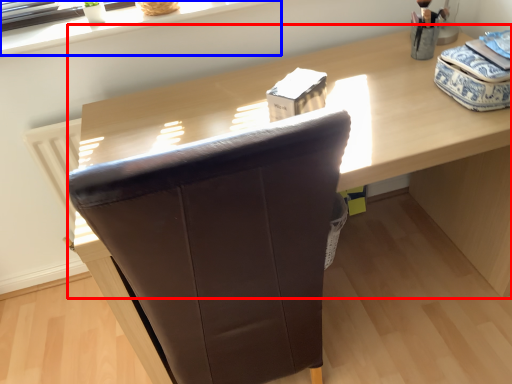
Question: Which of the following is the farthest to the observer, computer desk (highlighted by a red box) or window sill (highlighted by a blue box)?

Choices:
 (A) computer desk
 (B) window sill

Answer: (B)